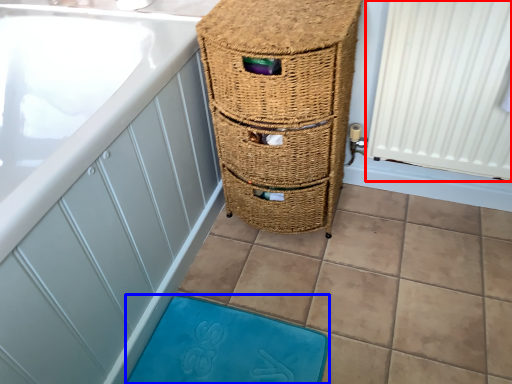
Question: Which point is further to the camera, radiator (highlighted by a red box) or bath mat (highlighted by a blue box)?

Choices:
 (A) radiator
 (B) bath mat

Answer: (B)